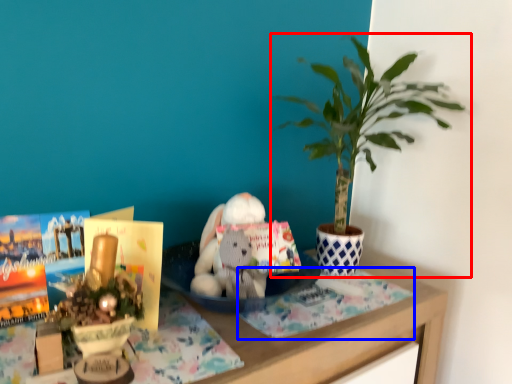
Question: Which object appears farthest to the camera in this image, houseplant (highlighted by a red box) or cloth (highlighted by a blue box)?

Choices:
 (A) houseplant
 (B) cloth

Answer: (B)